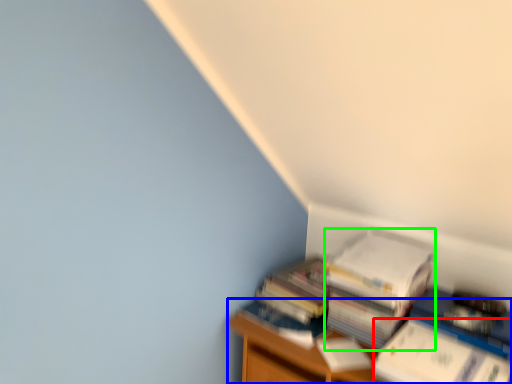
Question: Based on their relative distances, which object is nearer to paperback book (highlighted by a red box)? Choose from furniture (highlighted by a blue box) and paperback book (highlighted by a green box).

Choices:
 (A) furniture
 (B) paperback book

Answer: (B)